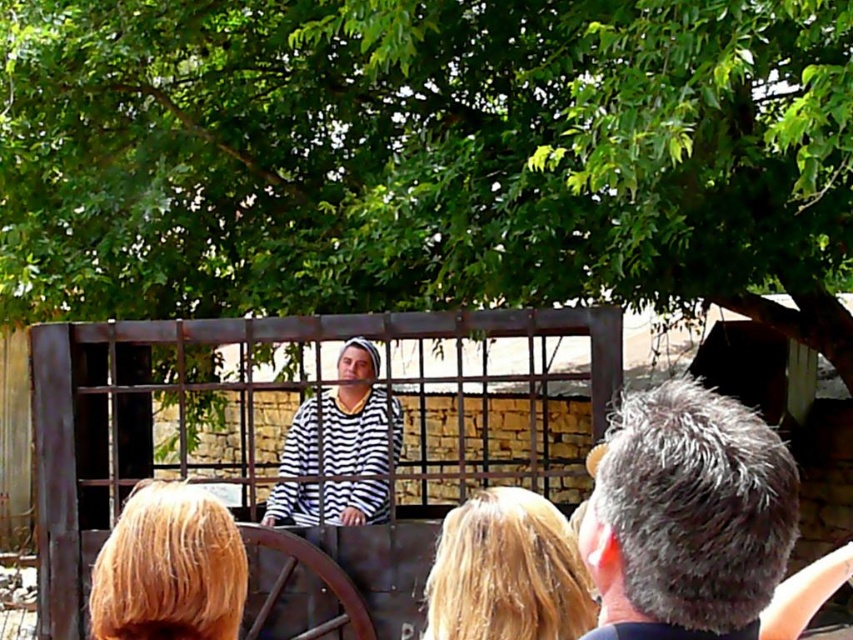
You are a photographer trying to capture the scene. You notice the gray matte hair at upper right and the striped fabric shirt at center. Which object should you focus on to ensure it takes up more space in your photo?

The striped fabric shirt at center takes up more space than the gray matte hair at upper right, so you should focus on the striped fabric shirt at center to ensure it occupies more space in your photo.

From the picture: You are a photographer trying to capture a portrait of the person with blonde hair at center without including the rusty metal cage at center in the frame. Based on their positions, is this possible?

The rusty metal cage at center is located below the blonde hair at center, so if you position your camera to focus on the blonde hair at center and avoid the lower area where the cage is placed, it should be possible to exclude the cage from the photo.